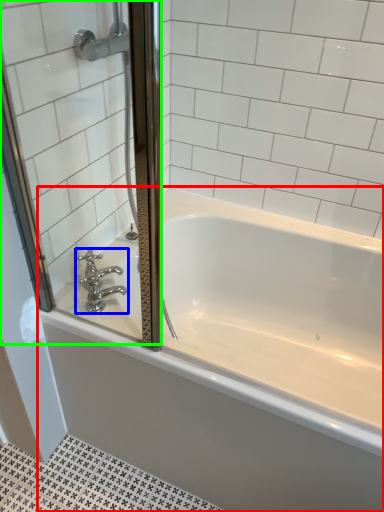
Question: Which is farther away from bathtub (highlighted by a red box)? tap (highlighted by a blue box) or screen door (highlighted by a green box)?

Choices:
 (A) tap
 (B) screen door

Answer: (A)